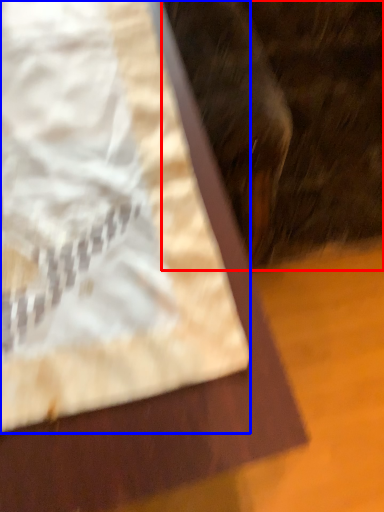
Question: Among these objects, which one is nearest to the camera, animal (highlighted by a red box) or sheet (highlighted by a blue box)?

Choices:
 (A) animal
 (B) sheet

Answer: (A)